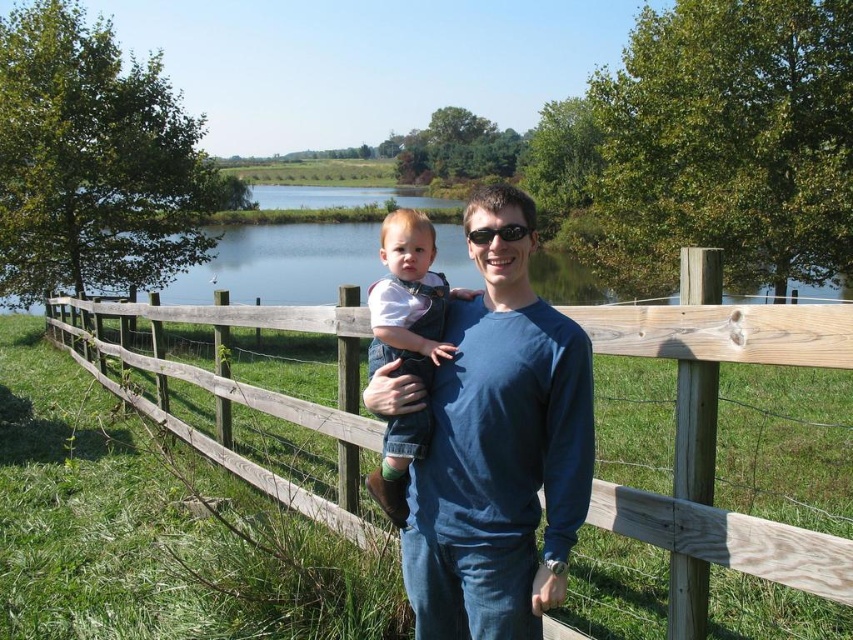
Question: Is denim overall at center to the left of black plastic sunglasses at center from the viewer's perspective?

Choices:
 (A) yes
 (B) no

Answer: (A)

Question: Which point is closer to the camera taking this photo?

Choices:
 (A) (308, 268)
 (B) (165, 371)

Answer: (B)

Question: Which object is farther from the camera taking this photo?

Choices:
 (A) blue water at center
 (B) denim overall at center
 (C) blue cotton shirt at center

Answer: (A)

Question: Considering the real-world distances, which object is closest to the denim overall at center?

Choices:
 (A) wooden fence at center
 (B) blue water at center

Answer: (A)

Question: Does wooden fence at center have a lesser width compared to blue cotton shirt at center?

Choices:
 (A) no
 (B) yes

Answer: (A)

Question: Does wooden fence at center lie in front of black plastic sunglasses at center?

Choices:
 (A) no
 (B) yes

Answer: (B)